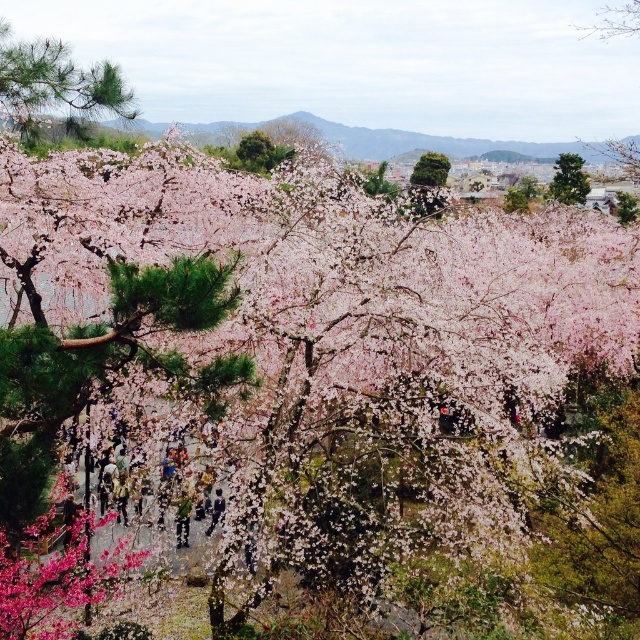
Question: Can you confirm if green matte tree at upper center is positioned below green leafy tree at center?

Choices:
 (A) yes
 (B) no

Answer: (B)

Question: Based on their relative distances, which object is farther from the green leafy tree at center?

Choices:
 (A) green textured pine tree at upper right
 (B) green matte pine tree at upper left
 (C) green fabric person at center

Answer: (C)

Question: Is green matte tree at upper center to the right of green fabric person at center from the viewer's perspective?

Choices:
 (A) yes
 (B) no

Answer: (A)

Question: Which object is closer to the camera taking this photo?

Choices:
 (A) green textured pine tree at upper right
 (B) green fabric person at center

Answer: (B)

Question: Based on their relative distances, which object is farther from the green matte tree at upper center?

Choices:
 (A) green textured pine tree at upper right
 (B) green fabric person at center
 (C) green matte pine tree at upper left
 (D) green leafy tree at center

Answer: (A)

Question: Can you confirm if green leafy tree at center is positioned above green fabric person at center?

Choices:
 (A) no
 (B) yes

Answer: (B)